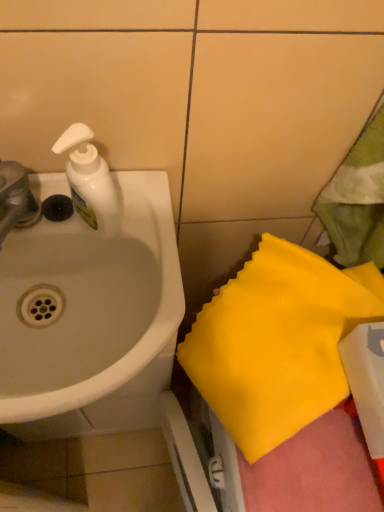
Question: In the image, is white plastic soap dispenser at upper left on the left side or the right side of metallic silver faucet at left?

Choices:
 (A) left
 (B) right

Answer: (B)

Question: Considering the positions of point (72, 142) and point (4, 196), is point (72, 142) closer or farther from the camera than point (4, 196)?

Choices:
 (A) farther
 (B) closer

Answer: (B)

Question: Considering the real-world distances, which object is closest to the metallic silver faucet at left?

Choices:
 (A) white glossy sink at left
 (B) yellow fabric at lower right
 (C) white plastic soap dispenser at upper left

Answer: (C)

Question: Which object is the closest to the white glossy sink at left?

Choices:
 (A) white plastic soap dispenser at upper left
 (B) metallic silver faucet at left
 (C) yellow fabric at lower right

Answer: (C)